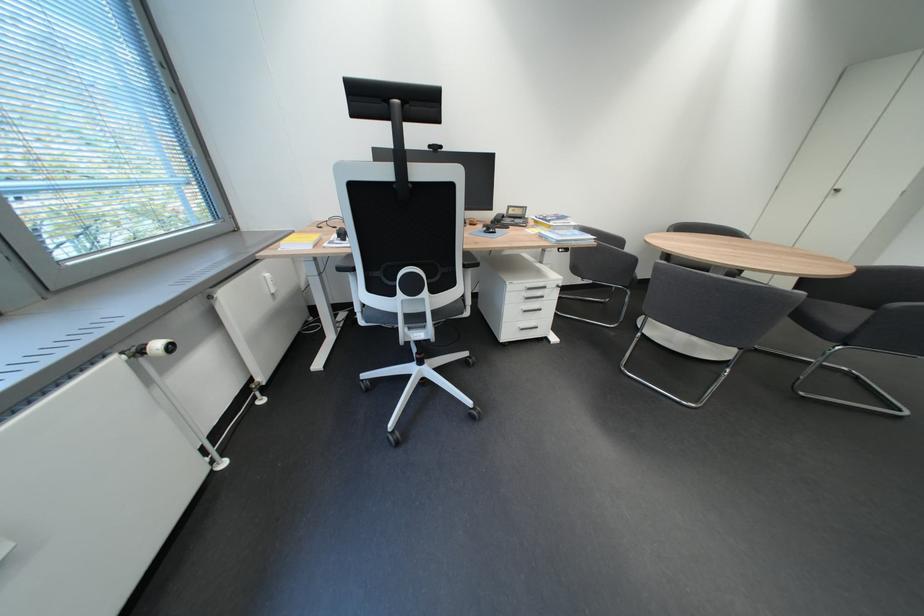
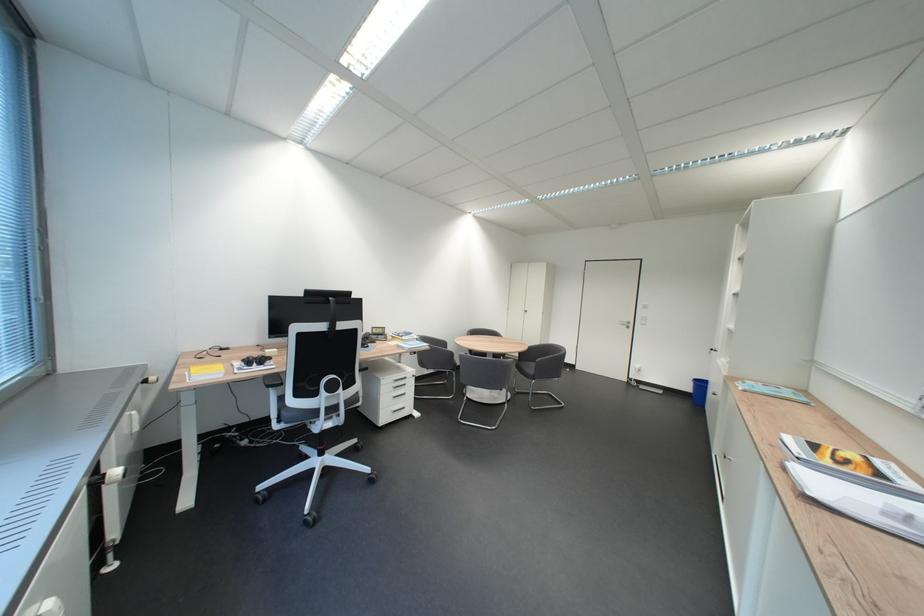
How did the camera likely rotate?

The camera rotated toward right-up.